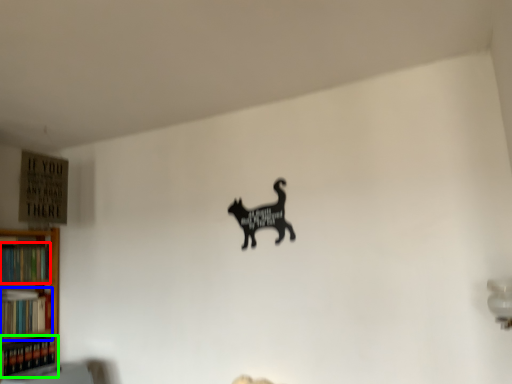
Question: Based on their relative distances, which object is nearer to book (highlighted by a red box)? Choose from book (highlighted by a blue box) and book (highlighted by a green box).

Choices:
 (A) book
 (B) book

Answer: (A)